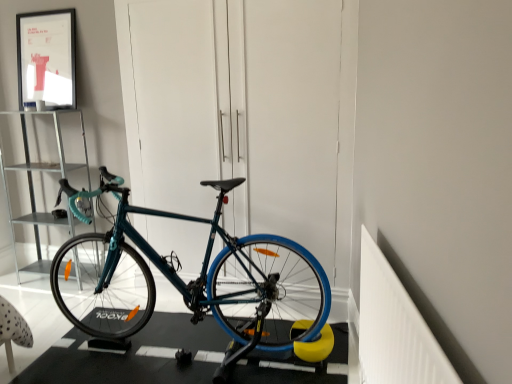
Question: Is metallic silver shelf at left at the back of matte black picture frame at upper left?

Choices:
 (A) no
 (B) yes

Answer: (A)

Question: Is metallic silver shelf at left completely or partially inside matte black picture frame at upper left?

Choices:
 (A) no
 (B) yes

Answer: (A)

Question: Would you say matte black picture frame at upper left is a long distance from metallic silver shelf at left?

Choices:
 (A) yes
 (B) no

Answer: (B)

Question: From a real-world perspective, is matte black picture frame at upper left physically above metallic silver shelf at left?

Choices:
 (A) yes
 (B) no

Answer: (A)

Question: Would you say matte black picture frame at upper left is outside metallic silver shelf at left?

Choices:
 (A) yes
 (B) no

Answer: (A)

Question: Considering the positions of metallic silver shelf at left and matte black picture frame at upper left in the image, is metallic silver shelf at left taller or shorter than matte black picture frame at upper left?

Choices:
 (A) short
 (B) tall

Answer: (B)

Question: Is metallic silver shelf at left wider or thinner than matte black picture frame at upper left?

Choices:
 (A) wide
 (B) thin

Answer: (A)

Question: Would you say metallic silver shelf at left is to the left or to the right of matte black picture frame at upper left in the picture?

Choices:
 (A) left
 (B) right

Answer: (A)

Question: From the image's perspective, relative to matte black picture frame at upper left, is metallic silver shelf at left above or below?

Choices:
 (A) above
 (B) below

Answer: (B)

Question: From the image's perspective, is teal matte bicycle at center above or below matte black picture frame at upper left?

Choices:
 (A) above
 (B) below

Answer: (B)

Question: Is teal matte bicycle at center situated inside matte black picture frame at upper left or outside?

Choices:
 (A) outside
 (B) inside

Answer: (A)

Question: Considering the positions of teal matte bicycle at center and matte black picture frame at upper left in the image, is teal matte bicycle at center taller or shorter than matte black picture frame at upper left?

Choices:
 (A) short
 (B) tall

Answer: (B)

Question: Looking at the image, does teal matte bicycle at center seem bigger or smaller compared to matte black picture frame at upper left?

Choices:
 (A) small
 (B) big

Answer: (B)

Question: In terms of width, does matte black picture frame at upper left look wider or thinner when compared to metallic silver shelf at left?

Choices:
 (A) thin
 (B) wide

Answer: (A)

Question: In terms of height, does matte black picture frame at upper left look taller or shorter compared to metallic silver shelf at left?

Choices:
 (A) tall
 (B) short

Answer: (B)